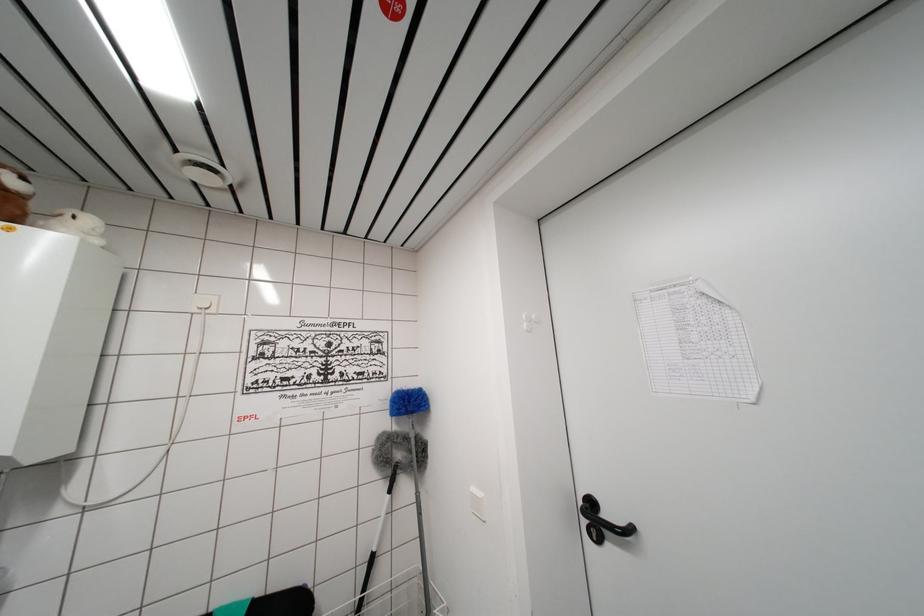
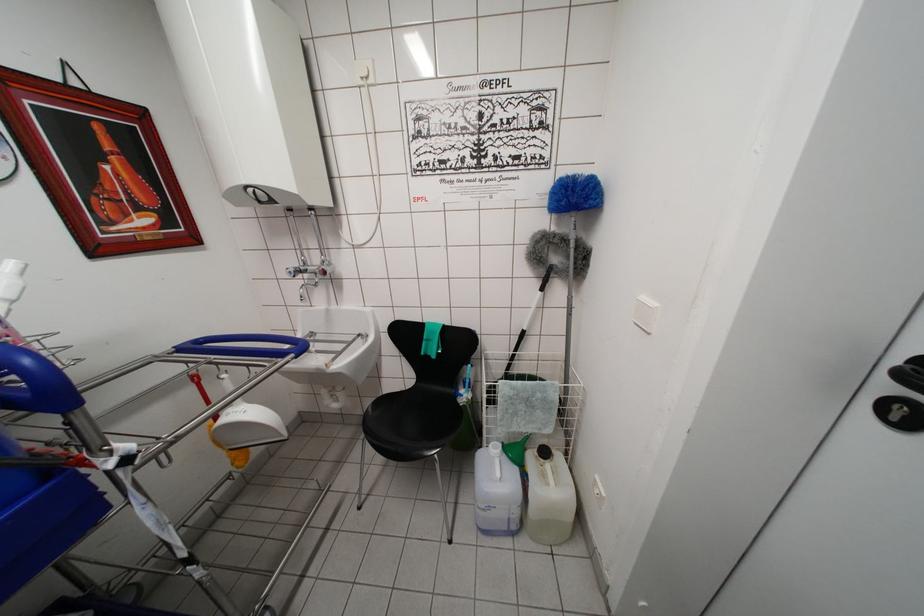
The point at (483,499) is marked in the first image. Where is the corresponding point in the second image?

(657, 308)